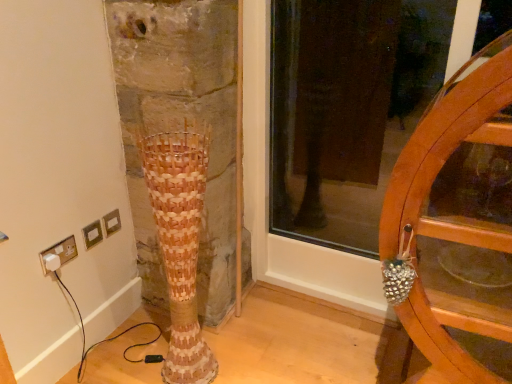
Question: In terms of width, does woven wood vase at center look wider or thinner when compared to white plastic plug at lower left?

Choices:
 (A) thin
 (B) wide

Answer: (B)

Question: Would you say woven wood vase at center is inside or outside white plastic plug at lower left?

Choices:
 (A) outside
 (B) inside

Answer: (A)

Question: Which is nearer to the white plastic plug at lower left?

Choices:
 (A) wooden wheel at right
 (B) woven wood vase at center

Answer: (B)

Question: Based on their relative distances, which object is nearer to the wooden wheel at right?

Choices:
 (A) woven wood vase at center
 (B) white plastic plug at lower left

Answer: (A)